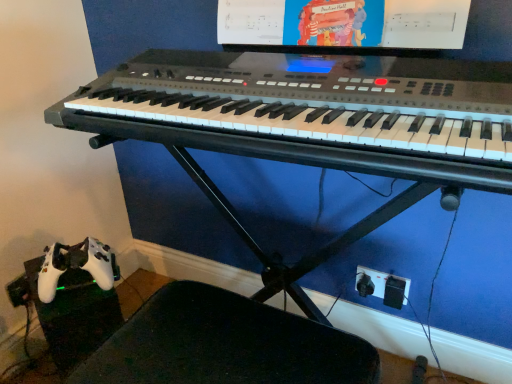
Question: Is black plastic plug at lower right to the right of matte plastic computer monitor at upper center from the viewer's perspective?

Choices:
 (A) yes
 (B) no

Answer: (A)

Question: Does black plastic plug at lower right have a larger size compared to matte plastic computer monitor at upper center?

Choices:
 (A) yes
 (B) no

Answer: (B)

Question: Can you confirm if black plastic plug at lower right is wider than matte plastic computer monitor at upper center?

Choices:
 (A) yes
 (B) no

Answer: (B)

Question: Considering the relative sizes of black plastic plug at lower right and matte plastic computer monitor at upper center in the image provided, is black plastic plug at lower right thinner than matte plastic computer monitor at upper center?

Choices:
 (A) no
 (B) yes

Answer: (B)

Question: From a real-world perspective, is black plastic plug at lower right positioned over matte plastic computer monitor at upper center based on gravity?

Choices:
 (A) no
 (B) yes

Answer: (A)

Question: Based on their positions, is black plastic swivel chair at lower left located to the left or right of black plastic plug at lower right?

Choices:
 (A) right
 (B) left

Answer: (B)

Question: From the image's perspective, is black plastic swivel chair at lower left located above or below black plastic plug at lower right?

Choices:
 (A) above
 (B) below

Answer: (B)

Question: Do you think black plastic swivel chair at lower left is within black plastic plug at lower right, or outside of it?

Choices:
 (A) inside
 (B) outside

Answer: (B)

Question: Considering the positions of point (218, 349) and point (356, 274), is point (218, 349) closer or farther from the camera than point (356, 274)?

Choices:
 (A) closer
 (B) farther

Answer: (A)

Question: In terms of width, does matte plastic computer monitor at upper center look wider or thinner when compared to black plastic swivel chair at lower left?

Choices:
 (A) wide
 (B) thin

Answer: (B)

Question: From a real-world perspective, is matte plastic computer monitor at upper center physically located above or below black plastic swivel chair at lower left?

Choices:
 (A) below
 (B) above

Answer: (B)

Question: Looking at the image, does matte plastic computer monitor at upper center seem bigger or smaller compared to black plastic swivel chair at lower left?

Choices:
 (A) big
 (B) small

Answer: (B)

Question: Based on their positions, is matte plastic computer monitor at upper center located to the left or right of black plastic swivel chair at lower left?

Choices:
 (A) left
 (B) right

Answer: (B)

Question: From the image's perspective, is satin black keyboard at center located above or below black plastic plug at lower right?

Choices:
 (A) below
 (B) above

Answer: (B)

Question: Would you say satin black keyboard at center is inside or outside black plastic plug at lower right?

Choices:
 (A) inside
 (B) outside

Answer: (B)